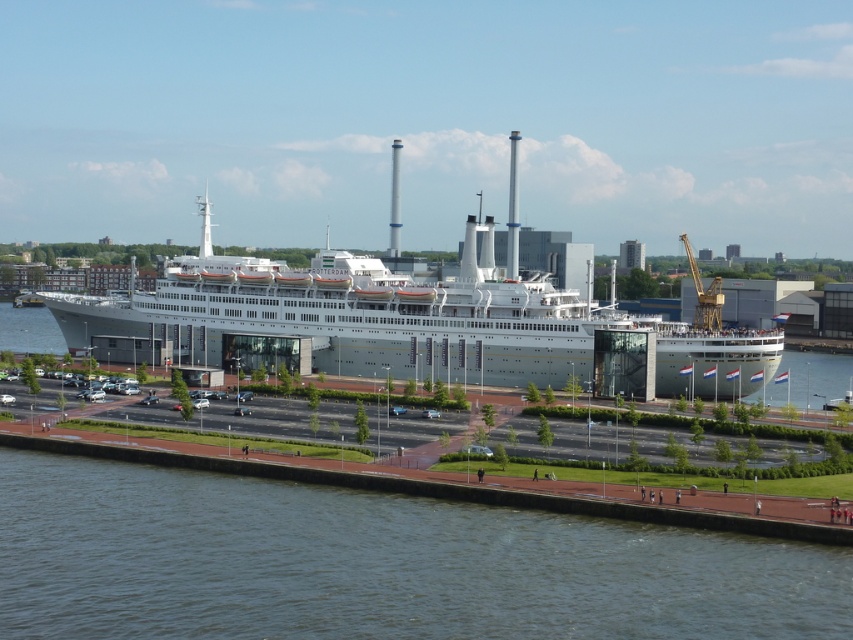
Question: Does dark blue water at lower center have a greater width compared to silver metallic cruise ship at center?

Choices:
 (A) no
 (B) yes

Answer: (A)

Question: Which object appears closest to the camera in this image?

Choices:
 (A) silver metallic cruise ship at center
 (B) dark blue water at lower center

Answer: (B)

Question: Is dark blue water at lower center below silver metallic cruise ship at center?

Choices:
 (A) yes
 (B) no

Answer: (A)

Question: Does dark blue water at lower center lie behind silver metallic cruise ship at center?

Choices:
 (A) yes
 (B) no

Answer: (B)

Question: Which point is closer to the camera?

Choices:
 (A) dark blue water at lower center
 (B) silver metallic cruise ship at center

Answer: (A)